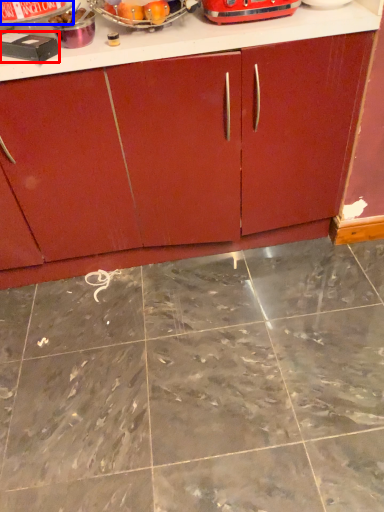
Question: Which object appears closest to the camera in this image, appliance (highlighted by a red box) or appliance (highlighted by a blue box)?

Choices:
 (A) appliance
 (B) appliance

Answer: (A)